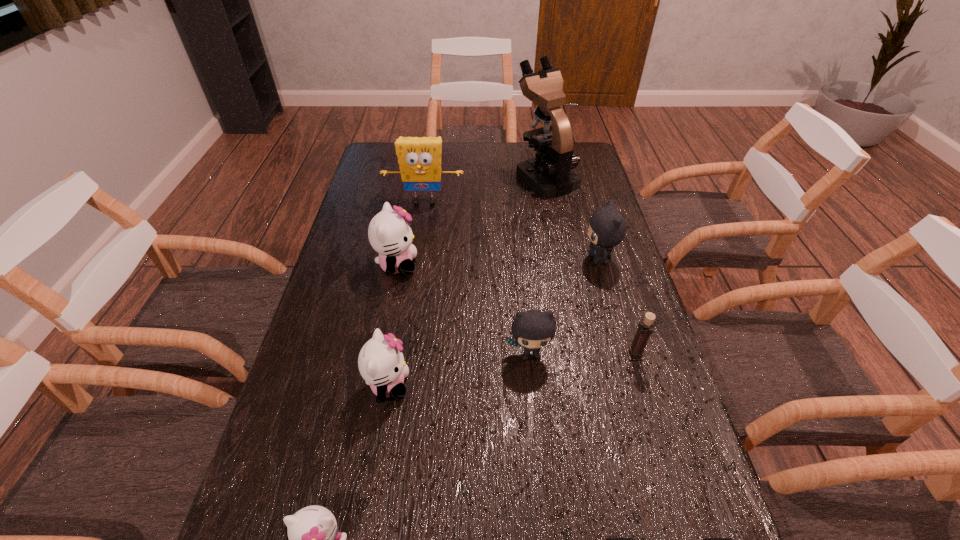
You are a GUI agent. You are given a task and a screenshot of the screen. Output one action in this format:
    pyautogui.click(x=<x>, y=<y>)
    Task: Click on the tallest object
    This screenshot has height=540, width=960.
    Given the screenshot: What is the action you would take?
    pyautogui.click(x=550, y=174)

You are a GUI agent. You are given a task and a screenshot of the screen. Output one action in this format:
    pyautogui.click(x=<x>, y=<y>)
    Task: Click on the sponge
    This screenshot has width=960, height=540.
    Given the screenshot: What is the action you would take?
    pyautogui.click(x=419, y=159)

Identify the location of yellow sponge. This screenshot has width=960, height=540. (419, 159).

Where is `the farthest white kitten`? The height and width of the screenshot is (540, 960). the farthest white kitten is located at coordinates (390, 235).

You are a GUI agent. You are given a task and a screenshot of the screen. Output one action in this format:
    pyautogui.click(x=<x>, y=<y>)
    Task: Click on the bigger gray kitten
    
    Given the screenshot: What is the action you would take?
    pyautogui.click(x=607, y=227)

Identify the location of the right gray kitten. Image resolution: width=960 pixels, height=540 pixels. (607, 227).

Image resolution: width=960 pixels, height=540 pixels. I want to click on candle holder, so click(x=645, y=326).

Locate an element on the screen. This screenshot has width=960, height=540. the second nearest white kitten is located at coordinates (381, 363).

Locate an element on the screen. the nearer gray kitten is located at coordinates (533, 329).

Locate an element on the screen. the fourth kitten from left to right is located at coordinates (533, 329).